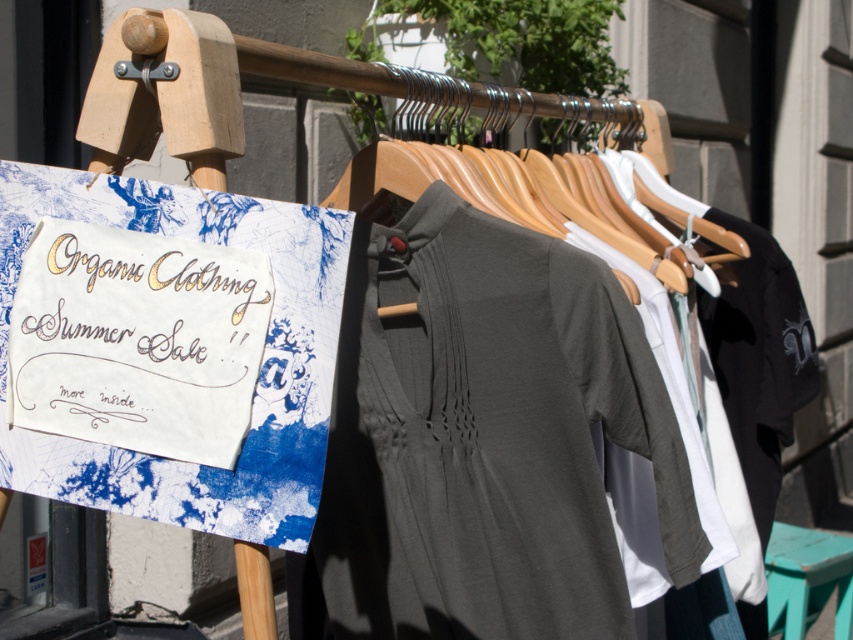
You are a customer looking at the gold calligraphy sign at upper left. Where exactly is the sign placed in relation to the clothes rack?

The gold calligraphy sign at upper left is located at point 0.531 on the x axis and 0.161 on the y axis relative to the clothes rack.

What are the coordinates of the wooden hanger at center?

The wooden hanger at center is located at point (506, 196).